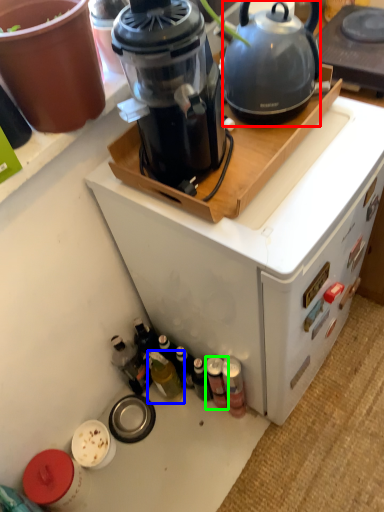
Question: Considering the real-world distances, which object is closest to kettle (highlighted by a red box)? bottle (highlighted by a blue box) or bottle (highlighted by a green box).

Choices:
 (A) bottle
 (B) bottle

Answer: (B)